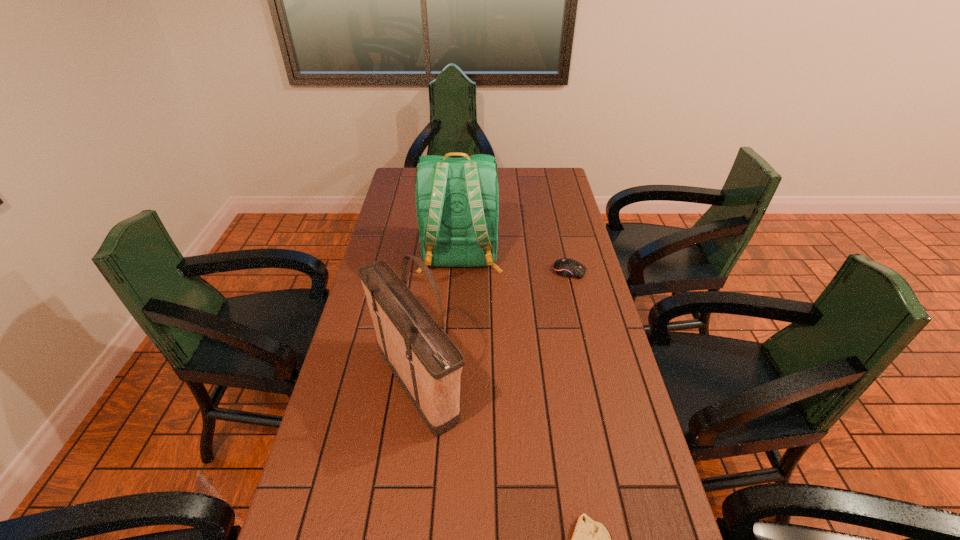
Locate an element on the screen. the second closest object to the third farthest object is located at coordinates (584, 539).

This screenshot has width=960, height=540. In order to click on vacant space that satisfies the following two spatial constraints: 1. on the back of the backpack; 2. on the right side of the third tallest object in this screenshot , I will do `click(460, 272)`.